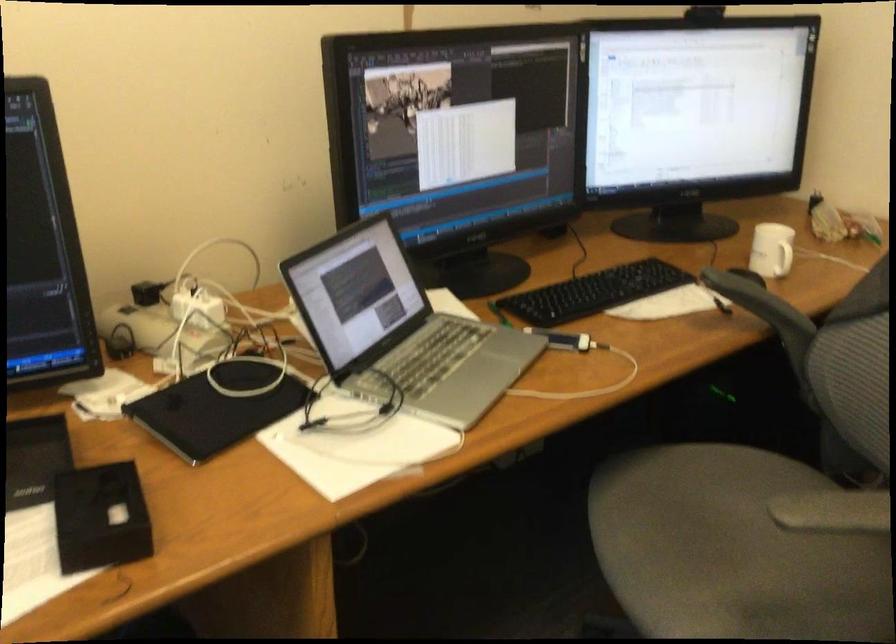
Find where to lift the white mug handle. Please return your answer as a coordinate pair (x, y).

(782, 259)